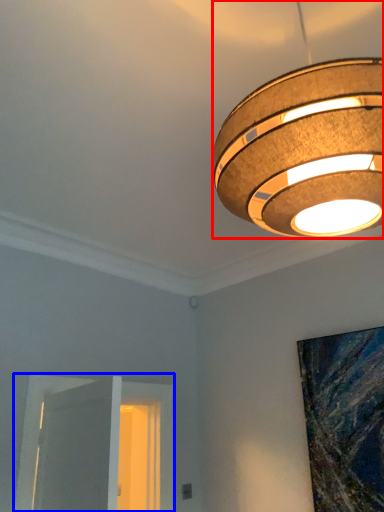
Question: Which object appears closest to the camera in this image, lamp (highlighted by a red box) or window (highlighted by a blue box)?

Choices:
 (A) lamp
 (B) window

Answer: (A)